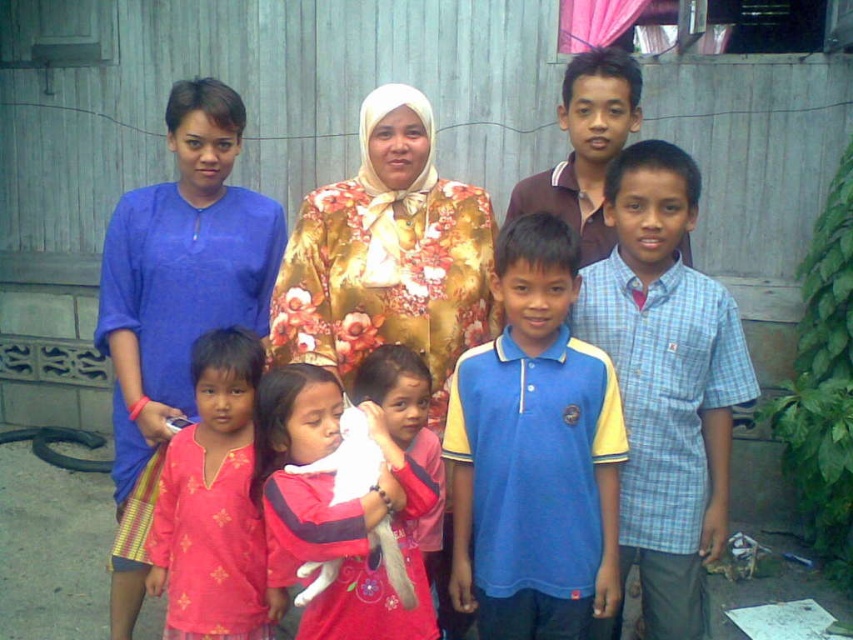
Does blue/yellow polo shirt at center have a lesser height compared to blue cotton shirt at left?

Indeed, blue/yellow polo shirt at center has a lesser height compared to blue cotton shirt at left.

Between point (477, 444) and point (135, 426), which one is positioned behind?

The point (135, 426) is more distant.

I want to click on blue/yellow polo shirt at center, so click(x=534, y=452).

Is light blue plaid shirt at right further to camera compared to floral-patterned fabric at center?

No, it is in front of floral-patterned fabric at center.

Who is taller, light blue plaid shirt at right or floral-patterned fabric at center?

Standing taller between the two is light blue plaid shirt at right.

Is point (646, 456) farther from camera compared to point (383, 92)?

No, it is not.

This screenshot has width=853, height=640. I want to click on light blue plaid shirt at right, so pyautogui.click(x=666, y=381).

Between blue/yellow polo shirt at center and light blue plaid shirt at right, which one appears on the right side from the viewer's perspective?

Positioned to the right is light blue plaid shirt at right.

Is point (468, 566) closer to camera compared to point (672, 192)?

No, it is not.

Where is `blue/yellow polo shirt at center`? Image resolution: width=853 pixels, height=640 pixels. blue/yellow polo shirt at center is located at coordinates (534, 452).